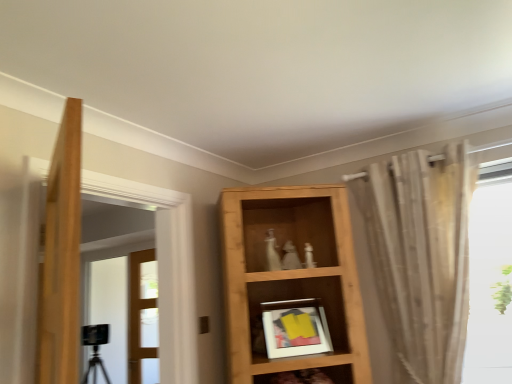
Question: From the image's perspective, is black glass door at left, positioned as the 1th door in left-to-right order, above or below wooden shelf at lower center, which is the second shelf in top-to-bottom order?

Choices:
 (A) below
 (B) above

Answer: (A)

Question: Does point (131, 362) appear closer or farther from the camera than point (345, 375)?

Choices:
 (A) closer
 (B) farther

Answer: (B)

Question: Estimate the real-world distances between objects in this image. Which object is closer to the wooden shelf at lower center, which is the second shelf in top-to-bottom order?

Choices:
 (A) clear glass door at center, marked as the 2th door in a left-to-right arrangement
 (B) sheer beige curtain at right
 (C) black glass door at left, positioned as the 2th door in right-to-left order
 (D) wooden shelf at center, which ranks as the second shelf in bottom-to-top order

Answer: (D)

Question: Estimate the real-world distances between objects in this image. Which object is closer to the wooden shelf at center, which ranks as the second shelf in bottom-to-top order?

Choices:
 (A) black glass door at left, positioned as the 2th door in right-to-left order
 (B) clear glass door at center, the first door positioned from the right
 (C) sheer beige curtain at right
 (D) wooden shelf at lower center, acting as the first shelf starting from the bottom

Answer: (C)